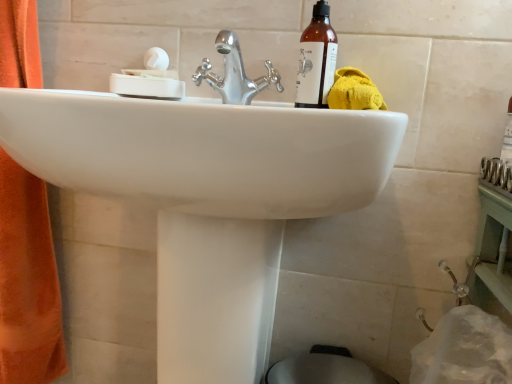
This screenshot has width=512, height=384. What do you see at coordinates (317, 59) in the screenshot? I see `brown glass bottle at upper right` at bounding box center [317, 59].

Find the location of a particular element. chrome metallic faucet at center is located at coordinates (234, 73).

What is the approximate height of yellow fabric towel at upper right?

yellow fabric towel at upper right is 3.70 inches tall.

Locate an element on the screen. This screenshot has width=512, height=384. white glossy sink at center is located at coordinates (207, 200).

Looking at their sizes, would you say white matte soap dish at upper left is wider or thinner than white glossy sink at center?

white matte soap dish at upper left is thinner than white glossy sink at center.

Which point is more distant from viewer, (141, 85) or (207, 367)?

Point (141, 85)

At what (x,y) coordinates should I click in order to perform the action: click on sink on the right of white matte soap dish at upper left. Please return your answer as a coordinate pair (x, y). The width and height of the screenshot is (512, 384). Looking at the image, I should click on (207, 200).

Looking at this image, is the surface of chrome metallic faucet at center in direct contact with white matte soap dish at upper left?

No, chrome metallic faucet at center is not next to white matte soap dish at upper left.

From the image's perspective, does chrome metallic faucet at center appear lower than white matte soap dish at upper left?

Yes, from the image's perspective, chrome metallic faucet at center is below white matte soap dish at upper left.

Considering the relative sizes of chrome metallic faucet at center and white matte soap dish at upper left in the image provided, is chrome metallic faucet at center taller than white matte soap dish at upper left?

Correct, chrome metallic faucet at center is much taller as white matte soap dish at upper left.

Find the location of a particular element. tissue that appears on the left of chrome metallic faucet at center is located at coordinates (149, 79).

Considering the sizes of objects white matte soap dish at upper left and yellow fabric towel at upper right in the image provided, who is thinner, white matte soap dish at upper left or yellow fabric towel at upper right?

Thinner between the two is white matte soap dish at upper left.

Is white matte soap dish at upper left taller or shorter than yellow fabric towel at upper right?

In the image, white matte soap dish at upper left appears to be taller than yellow fabric towel at upper right.

Is point (160, 50) farther from viewer compared to point (347, 88)?

That is True.

From a real-world perspective, is white matte soap dish at upper left above or below chrome metallic faucet at center?

Clearly, from a real-world perspective, white matte soap dish at upper left is below chrome metallic faucet at center.

How distant is white matte soap dish at upper left from chrome metallic faucet at center?

white matte soap dish at upper left is 4.49 inches from chrome metallic faucet at center.

From the image's perspective, is white matte soap dish at upper left over chrome metallic faucet at center?

Yes, from the image's perspective, white matte soap dish at upper left is above chrome metallic faucet at center.

Is white matte soap dish at upper left not near chrome metallic faucet at center?

No, white matte soap dish at upper left is in close proximity to chrome metallic faucet at center.

Based on the photo, based on their sizes in the image, would you say white matte soap dish at upper left is bigger or smaller than brown glass bottle at upper right?

Considering their sizes, white matte soap dish at upper left takes up more space than brown glass bottle at upper right.

Which is in front, white matte soap dish at upper left or brown glass bottle at upper right?

Positioned in front is brown glass bottle at upper right.

Is yellow fabric towel at upper right outside of chrome metallic faucet at center?

Absolutely, yellow fabric towel at upper right is external to chrome metallic faucet at center.

Based on the photo, is yellow fabric towel at upper right taller than chrome metallic faucet at center?

Incorrect, the height of yellow fabric towel at upper right is not larger of that of chrome metallic faucet at center.

From the picture: Relative to chrome metallic faucet at center, is yellow fabric towel at upper right in front or behind?

Result: Clearly, yellow fabric towel at upper right is behind chrome metallic faucet at center.

Which is more to the right, yellow fabric towel at upper right or chrome metallic faucet at center?

yellow fabric towel at upper right.

From a real-world perspective, is brown glass bottle at upper right positioned above or below yellow fabric towel at upper right?

In terms of real-world spatial position, brown glass bottle at upper right is above yellow fabric towel at upper right.

From the image's perspective, would you say brown glass bottle at upper right is shown under yellow fabric towel at upper right?

No, from the image's perspective, brown glass bottle at upper right is not below yellow fabric towel at upper right.

In the scene shown: Is brown glass bottle at upper right shorter than yellow fabric towel at upper right?

In fact, brown glass bottle at upper right may be taller than yellow fabric towel at upper right.

Looking at this image, between brown glass bottle at upper right and yellow fabric towel at upper right, which one has smaller size?

brown glass bottle at upper right is smaller.

Identify the location of tissue lying on the left of white glossy sink at center. The width and height of the screenshot is (512, 384). (149, 79).

Image resolution: width=512 pixels, height=384 pixels. What are the coordinates of `tap on the right of white matte soap dish at upper left` in the screenshot? It's located at (234, 73).

Consider the image. Looking at the image, which one is located further to white matte soap dish at upper left, white glossy sink at center or brown glass bottle at upper right?

white glossy sink at center is further to white matte soap dish at upper left.

From the image, which object appears to be farther from white matte soap dish at upper left, white glossy sink at center or yellow fabric towel at upper right?

The object further to white matte soap dish at upper left is white glossy sink at center.

Estimate the real-world distances between objects in this image. Which object is further from brown glass bottle at upper right, yellow fabric towel at upper right or chrome metallic faucet at center?

Among the two, chrome metallic faucet at center is located further to brown glass bottle at upper right.

Looking at the image, which one is located further to brown glass bottle at upper right, white glossy sink at center or chrome metallic faucet at center?

white glossy sink at center.

Estimate the real-world distances between objects in this image. Which object is further from brown glass bottle at upper right, yellow fabric towel at upper right or white matte soap dish at upper left?

Based on the image, white matte soap dish at upper left appears to be further to brown glass bottle at upper right.

When comparing their distances from white matte soap dish at upper left, does chrome metallic faucet at center or white glossy sink at center seem further?

white glossy sink at center is positioned further to the anchor white matte soap dish at upper left.

Based on their spatial positions, is yellow fabric towel at upper right or chrome metallic faucet at center closer to white glossy sink at center?

chrome metallic faucet at center is positioned closer to the anchor white glossy sink at center.

Based on their spatial positions, is white glossy sink at center or chrome metallic faucet at center closer to yellow fabric towel at upper right?

Based on the image, chrome metallic faucet at center appears to be nearer to yellow fabric towel at upper right.

Where is `bath towel between brown glass bottle at upper right and white glossy sink at center in the up-down direction`? The image size is (512, 384). bath towel between brown glass bottle at upper right and white glossy sink at center in the up-down direction is located at coordinates (354, 91).

The image size is (512, 384). Identify the location of tap between white matte soap dish at upper left and white glossy sink at center vertically. (234, 73).

Where is `bath towel between white matte soap dish at upper left and white glossy sink at center from top to bottom`? bath towel between white matte soap dish at upper left and white glossy sink at center from top to bottom is located at coordinates (354, 91).

Image resolution: width=512 pixels, height=384 pixels. Find the location of `tap between brown glass bottle at upper right and white glossy sink at center in the vertical direction`. tap between brown glass bottle at upper right and white glossy sink at center in the vertical direction is located at coordinates (234, 73).